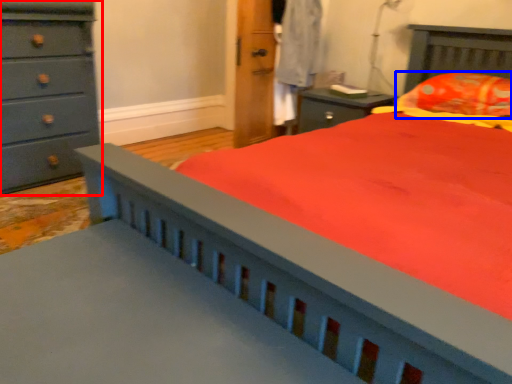
Question: Which object is closer to the camera taking this photo, chest of drawers (highlighted by a red box) or pillow (highlighted by a blue box)?

Choices:
 (A) chest of drawers
 (B) pillow

Answer: (B)